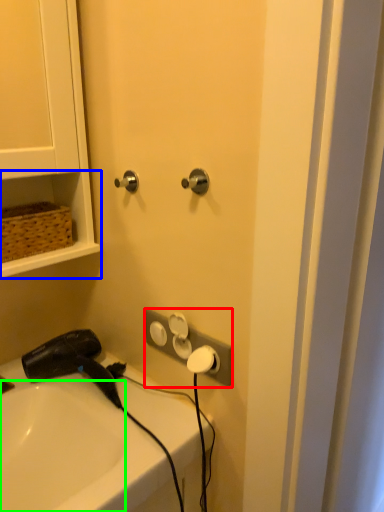
Question: Which is nearer to the electric outlet (highlighted by a red box)? shelf (highlighted by a blue box) or sink (highlighted by a green box).

Choices:
 (A) shelf
 (B) sink

Answer: (B)